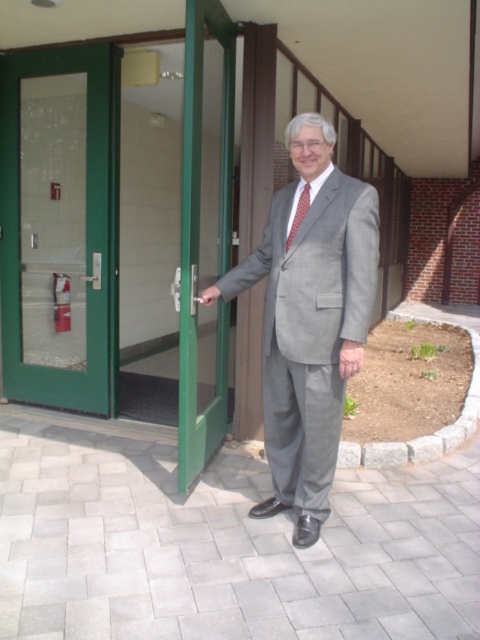
Question: Which point is closer to the camera?

Choices:
 (A) green glass door at left
 (B) green glass door at center
 (C) gray wool suit at center
 (D) red dotted tie at center

Answer: (C)

Question: Does green glass door at left appear on the right side of gray wool suit at center?

Choices:
 (A) no
 (B) yes

Answer: (A)

Question: Which point is farther from the camera taking this photo?

Choices:
 (A) (196, 380)
 (B) (297, 168)
 (C) (288, 236)
 (D) (10, 192)

Answer: (D)

Question: Is green glass door at left wider than red dotted tie at center?

Choices:
 (A) yes
 (B) no

Answer: (A)

Question: Does green glass door at left appear over red dotted tie at center?

Choices:
 (A) yes
 (B) no

Answer: (A)

Question: Which of the following is the farthest from the observer?

Choices:
 (A) (186, 420)
 (B) (264, 349)
 (C) (288, 248)
 (D) (68, 381)

Answer: (D)